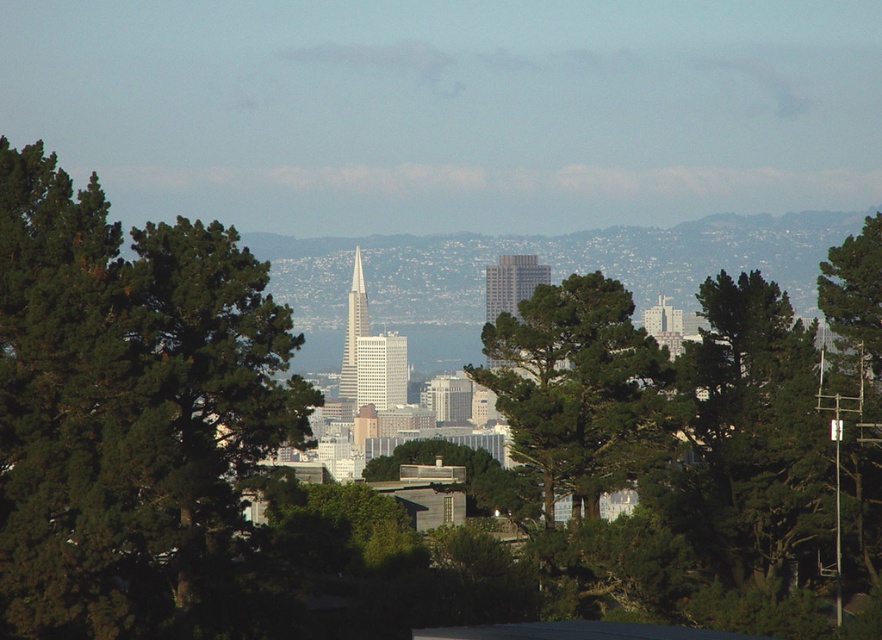
Measure the distance between green leafy tree at right and camera.

669.59 meters

Does green leafy tree at right appear on the right side of glassy silver skyscraper at center?

Correct, you'll find green leafy tree at right to the right of glassy silver skyscraper at center.

Who is more forward, (865,304) or (363,333)?

Point (363,333)

Locate an element on the screen. This screenshot has width=882, height=640. green leafy tree at right is located at coordinates (854, 291).

Does green leafy tree at left lie in front of white glass skyscraper at center?

No.

Is green leafy tree at left thinner than white glass skyscraper at center?

In fact, green leafy tree at left might be wider than white glass skyscraper at center.

Where is `green leafy tree at left`? green leafy tree at left is located at coordinates (126, 410).

Where is `green leafy tree at left`? The image size is (882, 640). green leafy tree at left is located at coordinates (126, 410).

Consider the image. Which is more to the right, green leafy tree at left or glassy silver skyscraper at center?

From the viewer's perspective, glassy silver skyscraper at center appears more on the right side.

Is point (41, 241) more distant than point (360, 259)?

That is True.

Is point (168, 563) positioned after point (353, 305)?

That is True.

The height and width of the screenshot is (640, 882). In order to click on green leafy tree at left in this screenshot , I will do `click(126, 410)`.